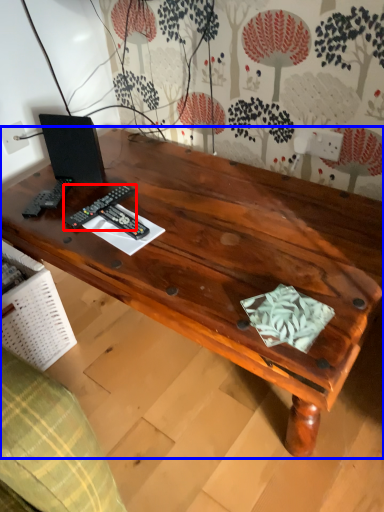
Question: Which point is closer to the camera, control (highlighted by a red box) or desk (highlighted by a blue box)?

Choices:
 (A) control
 (B) desk

Answer: (B)